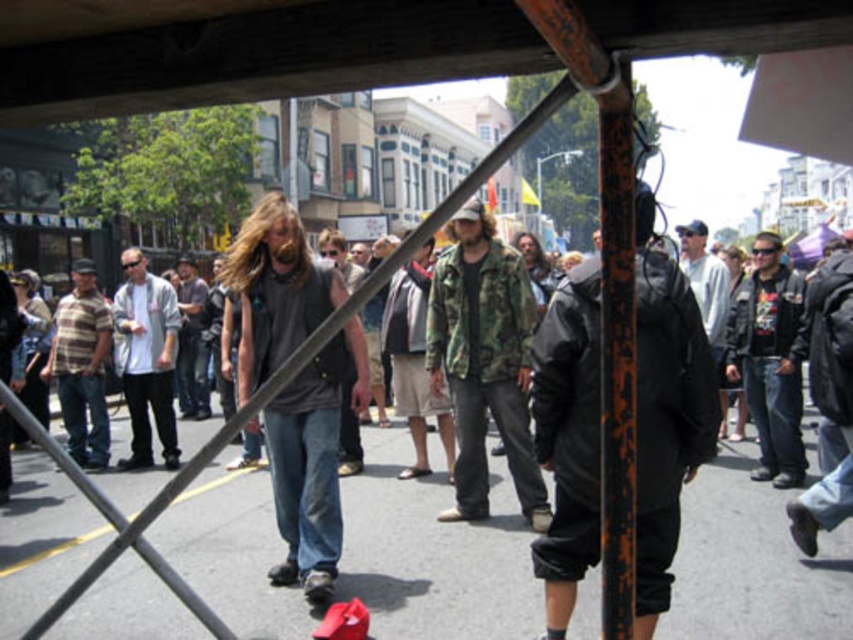
Based on the photo, is dark gray jacket at right bigger than black leather jacket at center?

No, dark gray jacket at right is not bigger than black leather jacket at center.

Is point (819, 276) positioned before point (722, 388)?

Yes, point (819, 276) is closer to viewer.

Where is `dark gray jacket at right`? This screenshot has height=640, width=853. dark gray jacket at right is located at coordinates (828, 397).

Can you confirm if dark gray fabric shirt at center is positioned below camouflage jacket at center?

Correct, dark gray fabric shirt at center is located below camouflage jacket at center.

Is point (263, 289) positioned after point (509, 252)?

No, it is in front of (509, 252).

Measure the distance between dark gray fabric shirt at center and camera.

dark gray fabric shirt at center and camera are 4.66 meters apart from each other.

Identify the location of dark gray fabric shirt at center. click(x=312, y=460).

Can you confirm if gray asphalt pavement at lower center is shorter than rusty metal pole at center?

Correct, gray asphalt pavement at lower center is not as tall as rusty metal pole at center.

Who is more forward, (216, 548) or (625, 252)?

Point (625, 252)

Is point (514, 547) in front of point (631, 451)?

That is False.

Image resolution: width=853 pixels, height=640 pixels. Find the location of `gray asphalt pavement at lower center`. gray asphalt pavement at lower center is located at coordinates pyautogui.click(x=434, y=560).